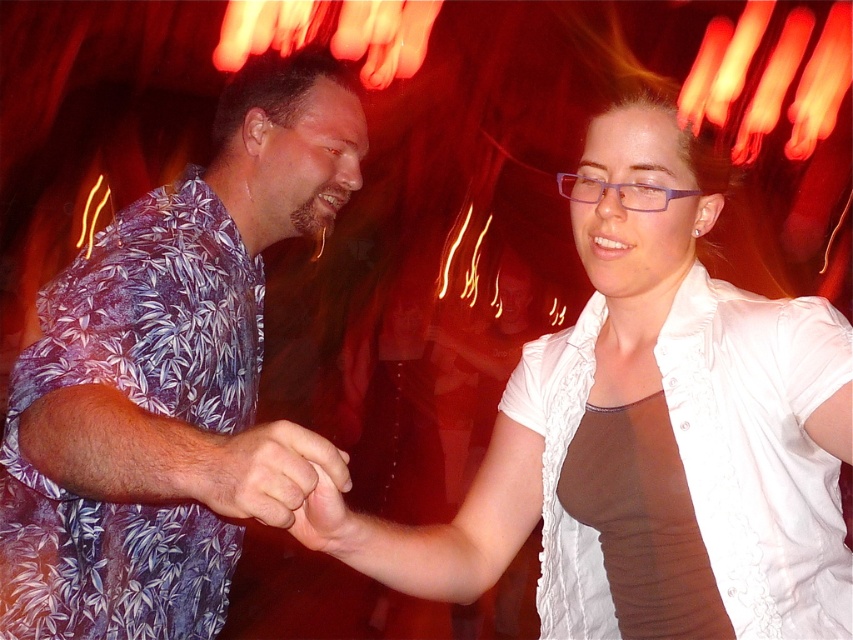
You are a photographer setting up a camera to capture the two individuals in the scene. The camera has a fixed width frame that can only accommodate the width of the wider of the two objects. Which of the two items, the white textured blouse at center or the matte floral shirt at center, should you ensure fits within the frame to guarantee both are fully visible?

The white textured blouse at center might be wider than matte floral shirt at center, so to ensure both are fully visible, the frame should be set to accommodate the width of the white textured blouse at center.